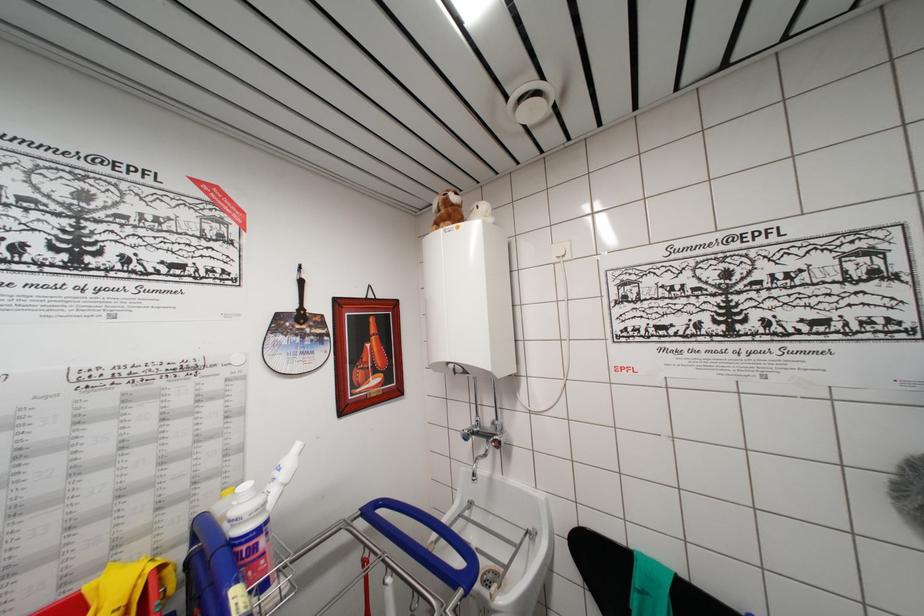
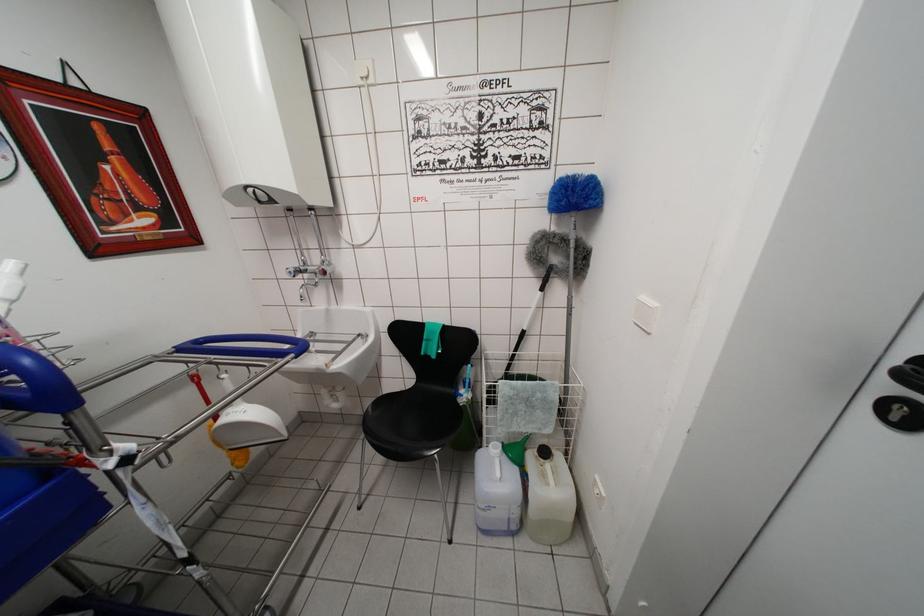
The point at (468, 440) is marked in the first image. Where is the corresponding point in the second image?

(293, 277)